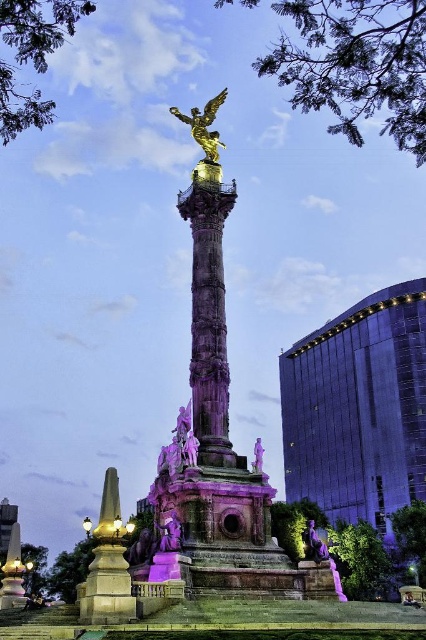
You are an architect evaluating the spatial layout of the monument area. You need to determine if the glossy glass building at right and the polished stone column at center can be seen in full from the main entrance which is located at the far left. Considering their widths, which one is more likely to block the view of the other?

The glossy glass building at right has a larger width than the polished stone column at center. Since the glossy glass building at right is wider, it is more likely to block the view of the polished stone column at center from the main entrance located at the far left.